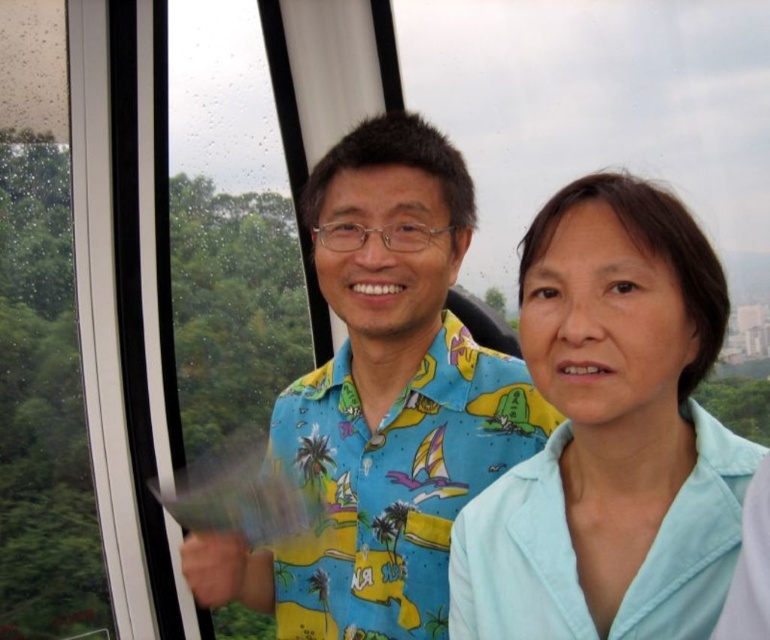
Find the location of a particular element. This screenshot has width=770, height=640. light blue fabric at center is located at coordinates (611, 435).

Which is more to the right, light blue fabric at center or printed fabric shirt at center?

From the viewer's perspective, light blue fabric at center appears more on the right side.

Is point (608, 378) more distant than point (355, 449)?

No, it is not.

Where is `light blue fabric at center`? The image size is (770, 640). light blue fabric at center is located at coordinates (611, 435).

Is printed fabric shirt at center smaller than transparent glass window at left?

Indeed, printed fabric shirt at center has a smaller size compared to transparent glass window at left.

Between point (400, 186) and point (32, 49), which one is positioned behind?

Point (32, 49)

Where is `printed fabric shirt at center`? The image size is (770, 640). printed fabric shirt at center is located at coordinates (382, 403).

Does point (457, 612) come in front of point (19, 372)?

Yes, point (457, 612) is in front of point (19, 372).

Who is higher up, light blue fabric at center or transparent glass window at left?

Positioned higher is transparent glass window at left.

What do you see at coordinates (611, 435) in the screenshot? The width and height of the screenshot is (770, 640). I see `light blue fabric at center` at bounding box center [611, 435].

This screenshot has width=770, height=640. In order to click on light blue fabric at center in this screenshot , I will do `click(611, 435)`.